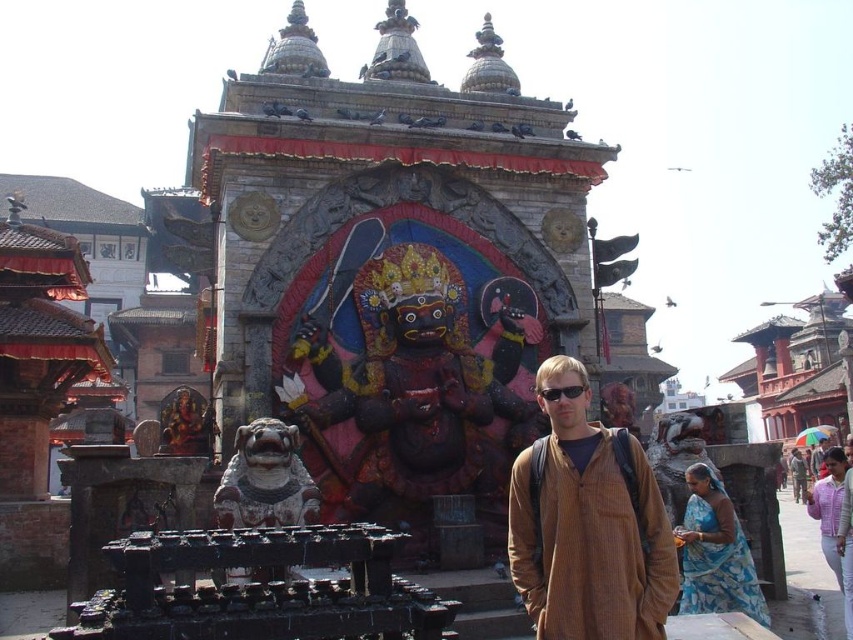
What object is located at the coordinates point (561,392) in the image?

The black plastic sunglasses at center is located at point (561,392).

Consider the image. You are a visitor at the temple and want to take a photo of both the polished stone lion at center and the polished gold statue at center. Which one should you focus on first to ensure both are in the frame?

You should focus on the polished gold statue at center first because the polished stone lion at center is in front of it, so adjusting the focus to include the background statue will help both be in the frame.

You are standing in front of the temple and see two points marked in the scene. Which point is closer to you, point (289, 356) or point (299, 433)?

Point (299, 433) is closer to you because point (289, 356) is behind it.